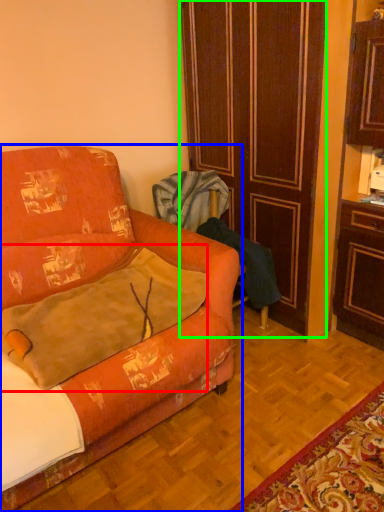
Question: Based on their relative distances, which object is nearer to throw pillow (highlighted by a red box)? Choose from studio couch (highlighted by a blue box) and door (highlighted by a green box).

Choices:
 (A) studio couch
 (B) door

Answer: (A)